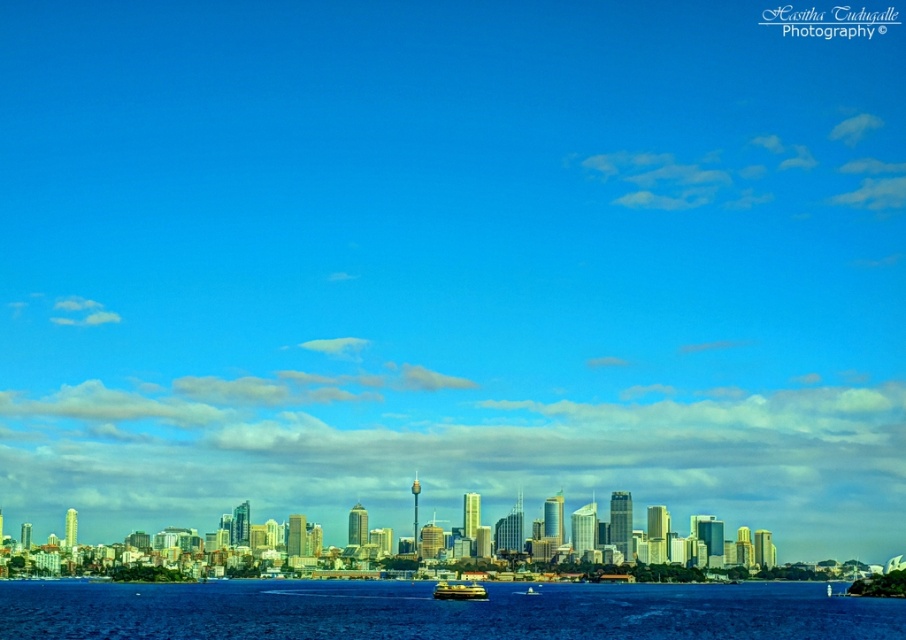
You are standing on a pier and see the blue liquid water at lower center and the yellow matte boat at center. Which object is positioned to the left when viewed from your perspective?

The blue liquid water at lower center is to the left of the yellow matte boat at center from your perspective.

You are standing on a dock and looking at the city skyline. You notice a point at coordinates point (439, 611). What is located at that point?

The blue liquid water at lower center is located at point (439, 611).